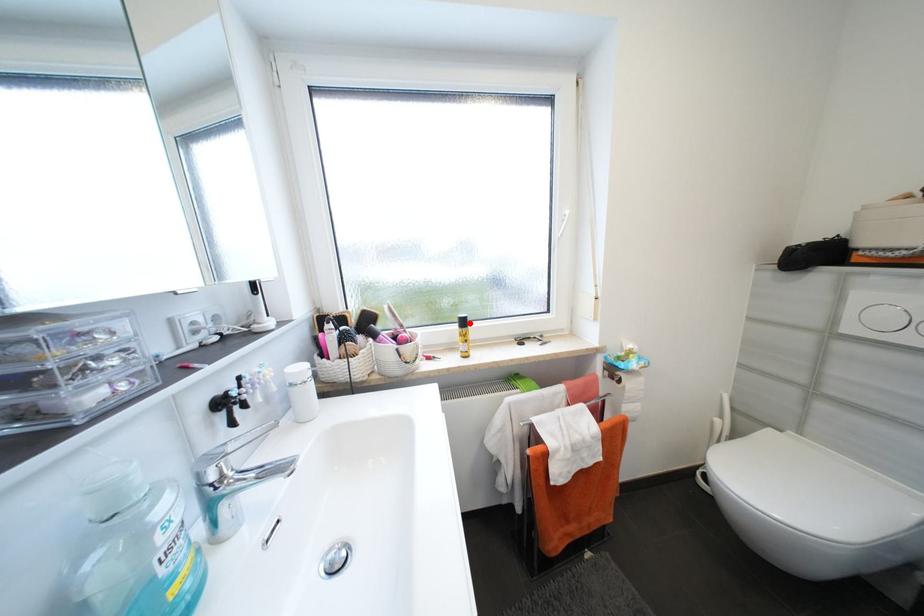
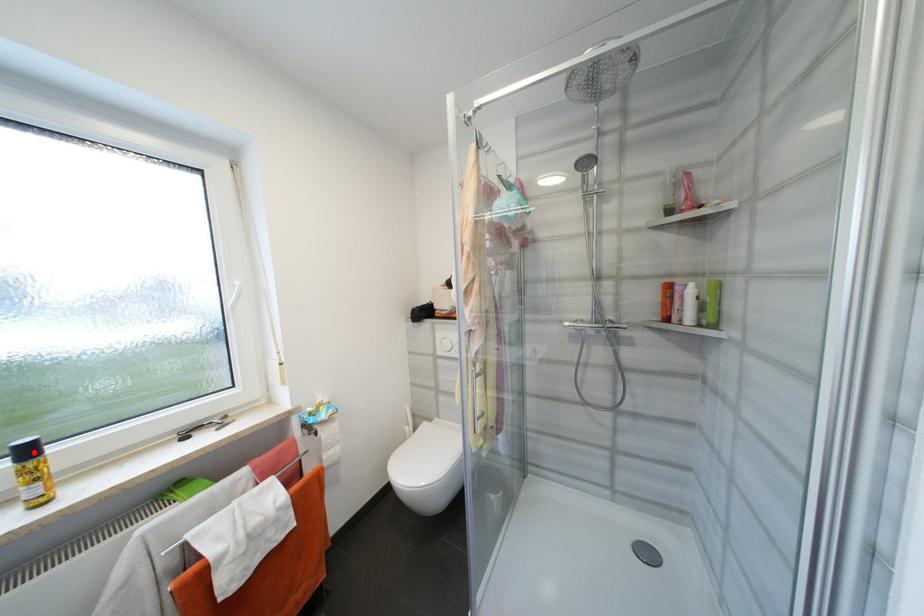
I am providing you with two images of the same scene from different viewpoints. A red point is marked on the first image and another point is marked on the second image. Do the highlighted points in image1 and image2 indicate the same real-world spot?

Yes